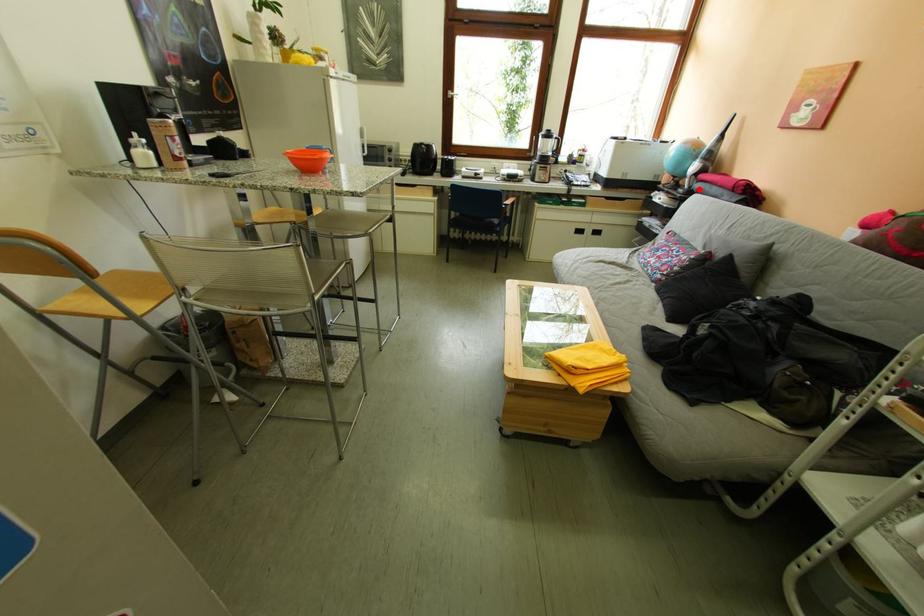
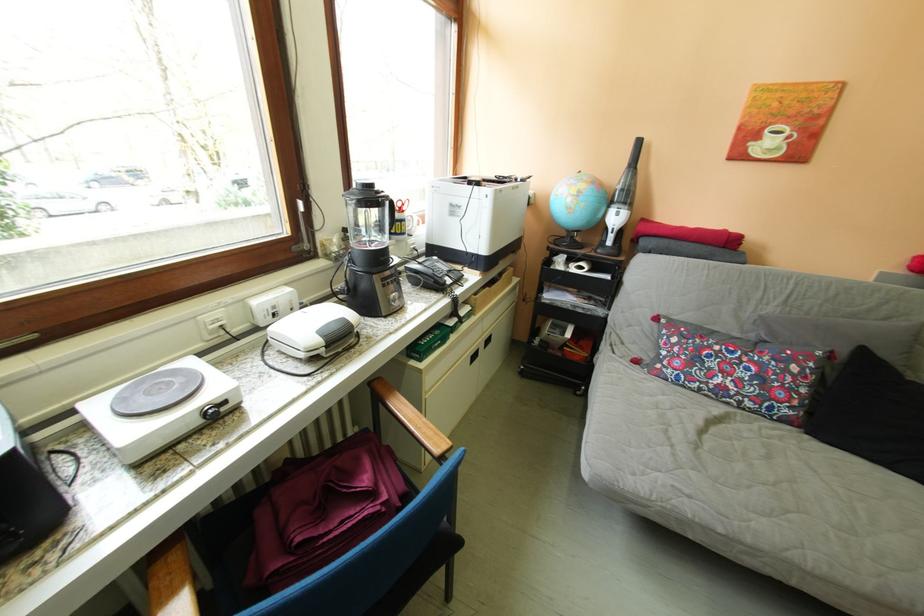
In the second image, find the point that corresponds to the highlighted location in the first image.

(622, 246)